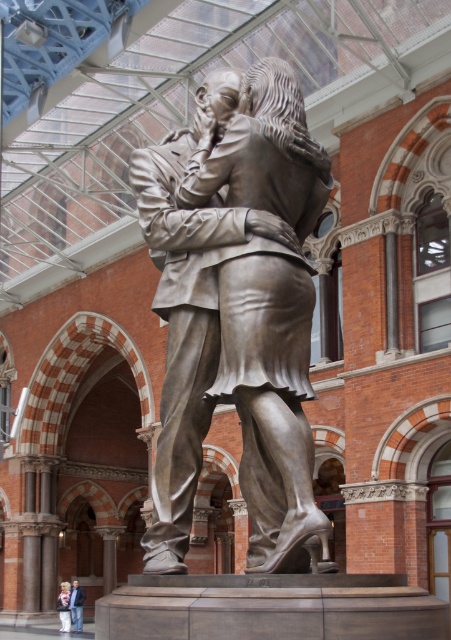
You are a tour guide leading a group and want to ensure everyone can see both the bronze statue at center and the white cotton shirt at lower left. Given that the average human field of view is about 120 degrees horizontally, can you position your group so they can see both objects without moving their heads?

The bronze statue at center and the white cotton shirt at lower left are 66.21 meters apart from each other. Since the average human field of view is 120 degrees horizontally, the group can position themselves so that both objects fall within this range. However, the actual feasibility depends on the distance from the group to the objects. If they are close enough, the 120 degree field of view should accommodate both.

You are an art conservator examining the sculpture. You notice two items at the lower left corner of the base. Which item is closer to you, the blue jeans at lower left or the white cotton shirt at lower left?

The blue jeans at lower left are closer to you because the white cotton shirt at lower left is behind them.